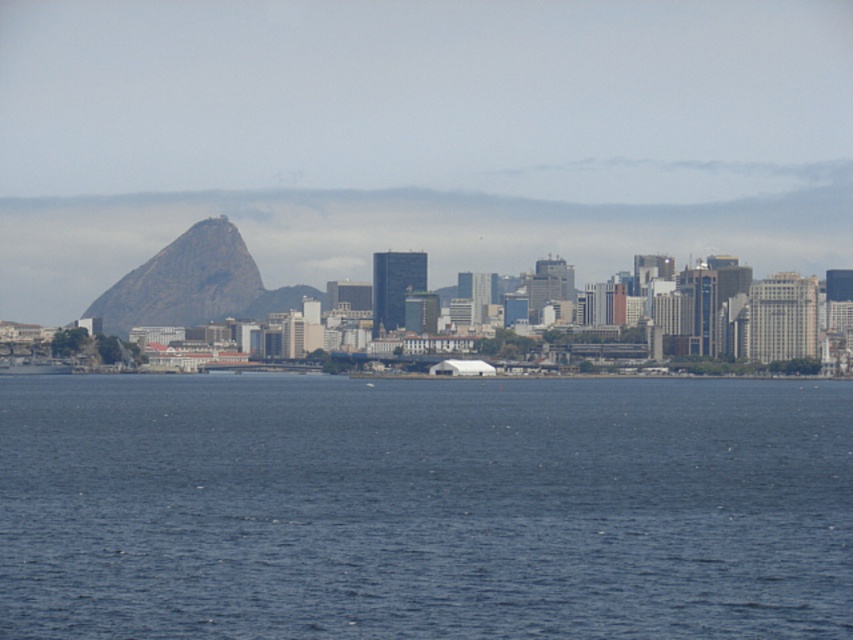
Is point (474, 488) less distant than point (109, 324)?

That is True.

Describe the element at coordinates (422, 508) in the screenshot. This screenshot has width=853, height=640. I see `blue water at center` at that location.

Locate an element on the screen. This screenshot has width=853, height=640. blue water at center is located at coordinates tap(422, 508).